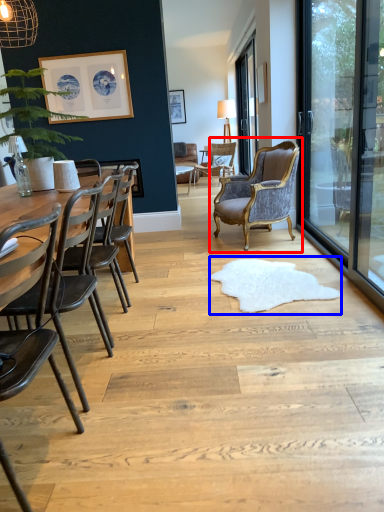
Question: Which object appears farthest to the camera in this image, chair (highlighted by a red box) or mat (highlighted by a blue box)?

Choices:
 (A) chair
 (B) mat

Answer: (A)